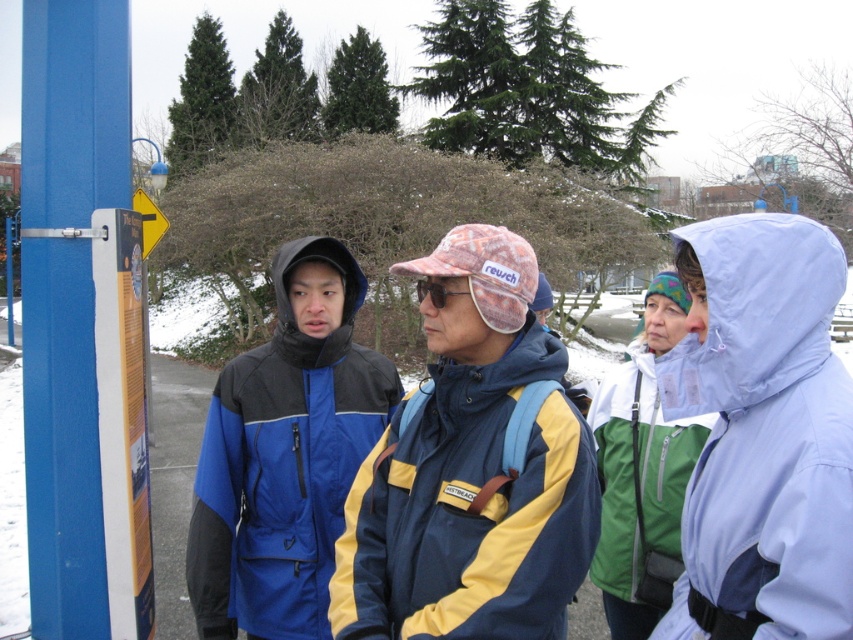
Is blue painted metal signpost at left positioned in front of pink fabric goggles at center?

No, blue painted metal signpost at left is further to the viewer.

Where is `blue painted metal signpost at left`? blue painted metal signpost at left is located at coordinates (82, 326).

Is point (99, 24) closer to viewer compared to point (418, 291)?

No, it is behind (418, 291).

Identify the location of blue painted metal signpost at left. (82, 326).

Is light blue waterproof jacket at right positioned before green matte jacket at center?

That is True.

The height and width of the screenshot is (640, 853). Find the location of `light blue waterproof jacket at right`. light blue waterproof jacket at right is located at coordinates (762, 433).

Where is `light blue waterproof jacket at right`? light blue waterproof jacket at right is located at coordinates (762, 433).

Does light blue waterproof jacket at right come behind pink fabric goggles at center?

No.

Is light blue waterproof jacket at right positioned in front of pink fabric goggles at center?

That is True.

The width and height of the screenshot is (853, 640). What are the coordinates of `light blue waterproof jacket at right` in the screenshot? It's located at (762, 433).

Identify the location of light blue waterproof jacket at right. (762, 433).